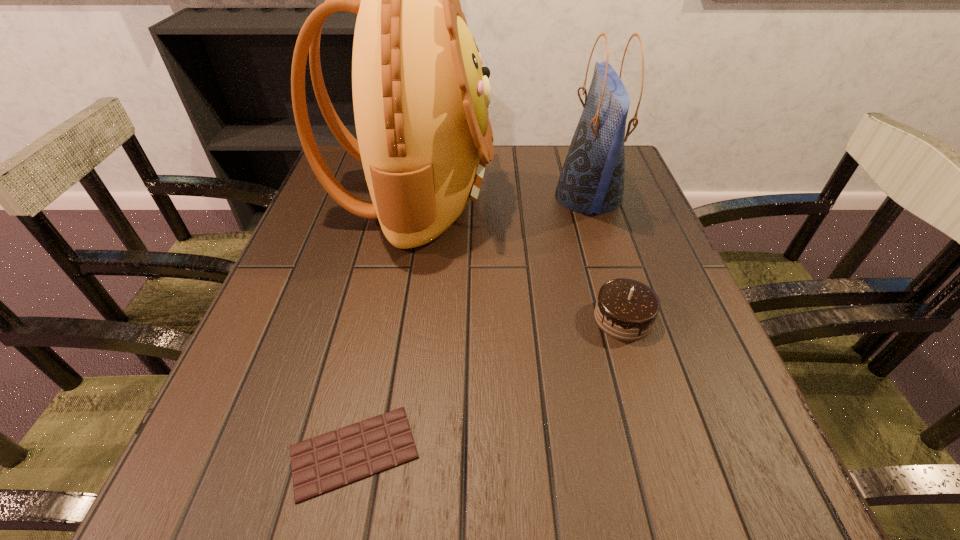
Locate an element on the screen. This screenshot has width=960, height=540. vacant space at the far edge of the desktop is located at coordinates (525, 156).

Where is `free space at the left edge of the desktop`? The image size is (960, 540). free space at the left edge of the desktop is located at coordinates (238, 430).

You are a GUI agent. You are given a task and a screenshot of the screen. Output one action in this format:
    pyautogui.click(x=<x>, y=<y>)
    Task: Click on the vacant region at the right edge of the desktop
    This screenshot has height=540, width=960.
    Given the screenshot: What is the action you would take?
    pyautogui.click(x=630, y=213)

This screenshot has width=960, height=540. What are the coordinates of `vacant space at the near left corner of the desktop` in the screenshot? It's located at (256, 460).

Locate an element on the screen. empty location between the shopping bag and the chocolate bar is located at coordinates (471, 325).

Find the location of a particular element. The image size is (960, 540). free space that is in between the backpack and the nearest object is located at coordinates (384, 325).

At what (x,y) coordinates should I click in order to perform the action: click on free point between the second tallest object and the shortest object. Please return your answer as a coordinate pair (x, y). Looking at the image, I should click on point(471,325).

Where is `vacant area that lies between the nearest object and the chocolate cake`? This screenshot has width=960, height=540. vacant area that lies between the nearest object and the chocolate cake is located at coordinates (489, 385).

The image size is (960, 540). I want to click on free space between the chocolate bar and the second nearest object, so pyautogui.click(x=489, y=385).

Where is `free spot between the second nearest object and the nearest object`? This screenshot has height=540, width=960. free spot between the second nearest object and the nearest object is located at coordinates (489, 385).